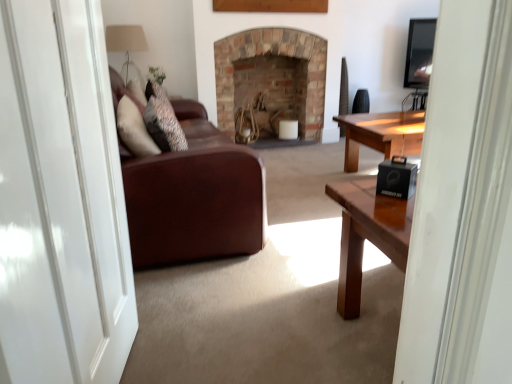
Question: In the image, is translucent glass lampshade at upper left positioned in front of or behind black matte speaker at lower right?

Choices:
 (A) behind
 (B) front

Answer: (A)

Question: From a real-world perspective, is translucent glass lampshade at upper left above or below black matte speaker at lower right?

Choices:
 (A) below
 (B) above

Answer: (B)

Question: Which of these objects is positioned closest to the white glossy door at left?

Choices:
 (A) brick fireplace at center
 (B) black matte speaker at lower right
 (C) leather couch at center
 (D) translucent glass lampshade at upper left

Answer: (C)

Question: Which object is positioned farthest from the black matte speaker at lower right?

Choices:
 (A) leather couch at center
 (B) translucent glass lampshade at upper left
 (C) brick fireplace at center
 (D) white glossy door at left

Answer: (B)